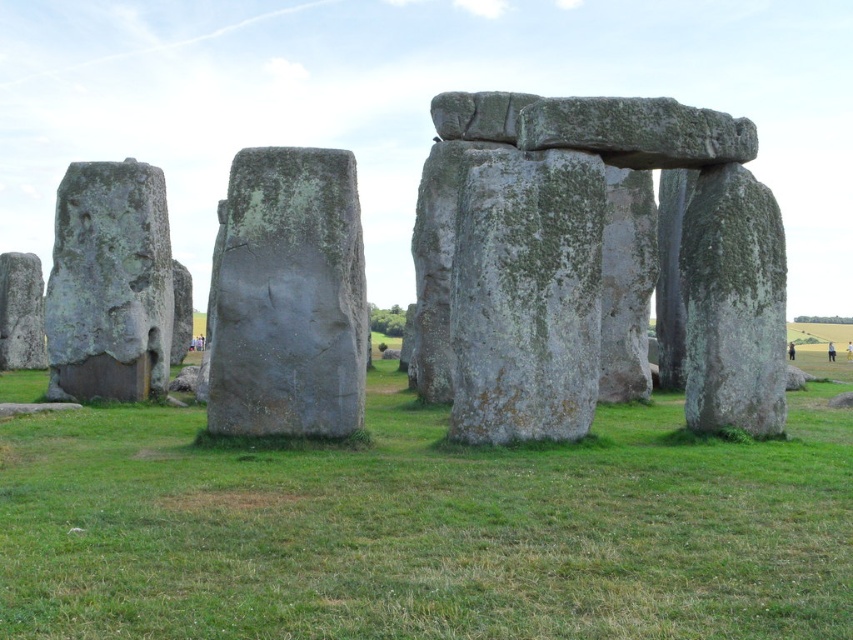
Question: Can you confirm if gray stone monoliths at center is wider than gray rough stone face at left?

Choices:
 (A) no
 (B) yes

Answer: (B)

Question: Which of the following is the farthest from the observer?

Choices:
 (A) (735, 483)
 (B) (549, 230)

Answer: (B)

Question: Can you confirm if gray stone monoliths at center is positioned to the left of gray rough stone face at left?

Choices:
 (A) no
 (B) yes

Answer: (A)

Question: Which of the following is the closest to the observer?

Choices:
 (A) green mossy stone at center
 (B) gray stone monoliths at center
 (C) gray stone structure at center

Answer: (C)

Question: Does green grass at center appear under gray rough stone face at left?

Choices:
 (A) no
 (B) yes

Answer: (B)

Question: Estimate the real-world distances between objects in this image. Which object is farther from the gray rough stone face at left?

Choices:
 (A) gray stone monoliths at center
 (B) green grass at center

Answer: (A)